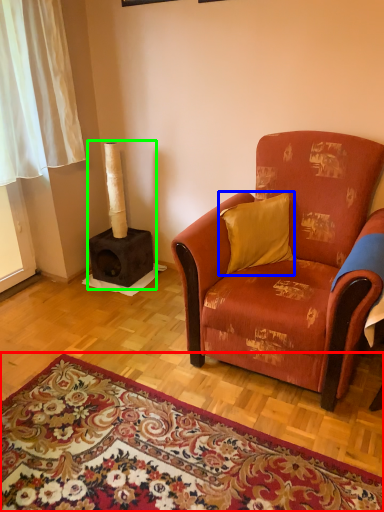
Question: Estimate the real-world distances between objects in this image. Which object is closer to mat (highlighted by a red box), pillow (highlighted by a blue box) or fireplace (highlighted by a green box)?

Choices:
 (A) pillow
 (B) fireplace

Answer: (A)